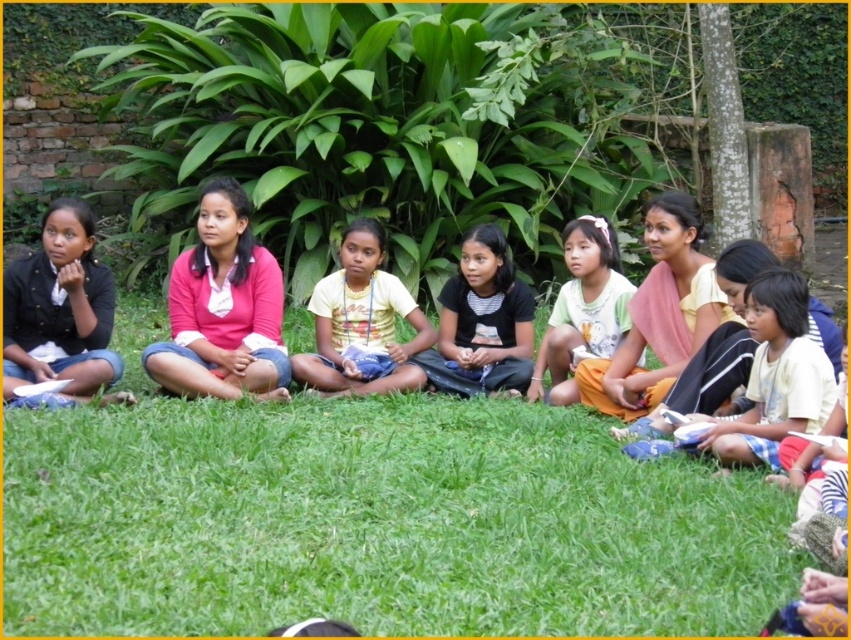
Between point (809, 388) and point (563, 401), which one is positioned in front?

Point (809, 388) is more forward.

Who is positioned more to the right, white cotton shirt at center or yellow cotton skirt at center?

white cotton shirt at center is more to the right.

Find the location of a particular element. The width and height of the screenshot is (851, 640). white cotton shirt at center is located at coordinates (775, 376).

Can you confirm if black matte jacket at left is positioned below white cotton shirt at center?

No.

Does black matte jacket at left have a larger size compared to white cotton shirt at center?

Yes, black matte jacket at left is bigger than white cotton shirt at center.

Between point (56, 244) and point (768, 339), which one is positioned in front?

Positioned in front is point (768, 339).

Identify the location of black matte jacket at left. Image resolution: width=851 pixels, height=640 pixels. (60, 310).

Is yellow matte shirt at center smaller than yellow cotton skirt at center?

No, yellow matte shirt at center is not smaller than yellow cotton skirt at center.

Does yellow matte shirt at center appear on the left side of yellow cotton skirt at center?

Yes, yellow matte shirt at center is to the left of yellow cotton skirt at center.

Is point (397, 307) positioned before point (586, 269)?

No, (397, 307) is further to viewer.

Where is `yellow matte shirt at center`? yellow matte shirt at center is located at coordinates (363, 323).